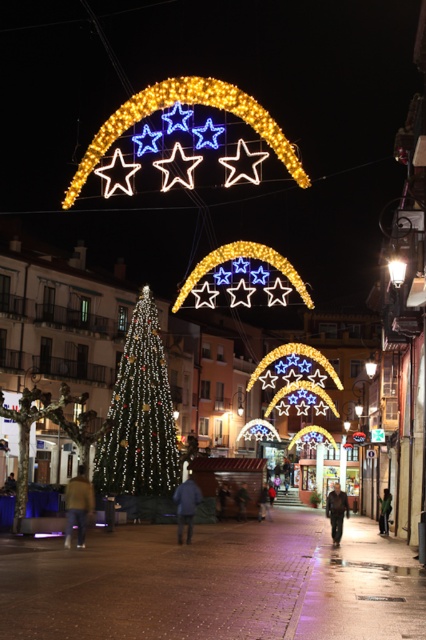
Question: Does brown fuzzy jacket at lower left appear on the left side of green fabric jacket at center?

Choices:
 (A) no
 (B) yes

Answer: (B)

Question: Does illuminated glass christmas tree at center have a greater width compared to green fabric jacket at center?

Choices:
 (A) yes
 (B) no

Answer: (A)

Question: Where is blue fabric jacket at center located in relation to green fabric jacket at center in the image?

Choices:
 (A) below
 (B) above

Answer: (B)

Question: Based on their relative distances, which object is nearer to the dark gray jacket at center?

Choices:
 (A) blue fabric jacket at center
 (B) brown fuzzy jacket at lower left
 (C) metallic streetlight at upper right

Answer: (A)

Question: Which object is closer to the camera taking this photo?

Choices:
 (A) blue fabric jacket at center
 (B) brown fuzzy jacket at lower left

Answer: (B)

Question: Which point is farther to the camera?

Choices:
 (A) illuminated wireframe star at upper center
 (B) illuminated glass christmas tree at center

Answer: (A)